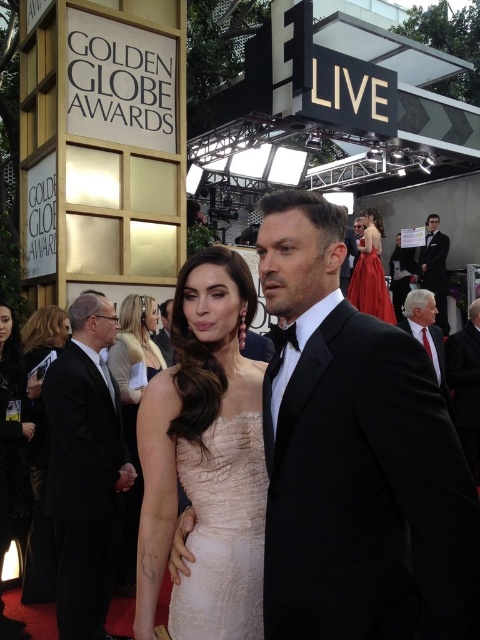
You are a photographer at the Golden Globe Awards red carpet. You need to capture a photo that includes both the black leather dress at lower left and the white textured suit at right. Given their sizes, which one should you zoom in on to ensure both fit in the frame?

The black leather dress at lower left is larger in size than the white textured suit at right, so you should zoom out slightly to ensure both fit in the frame.

You are a photographer at the Golden Globe Awards red carpet. You need to capture a photo of both the ivory lace dress at center and the black satin suit at right. Given their sizes, which one should you focus on first to ensure both fit in the frame?

The ivory lace dress at center is bigger than the black satin suit at right, so you should focus on the ivory lace dress at center first to ensure it fits in the frame, allowing space for the smaller black satin suit at right.